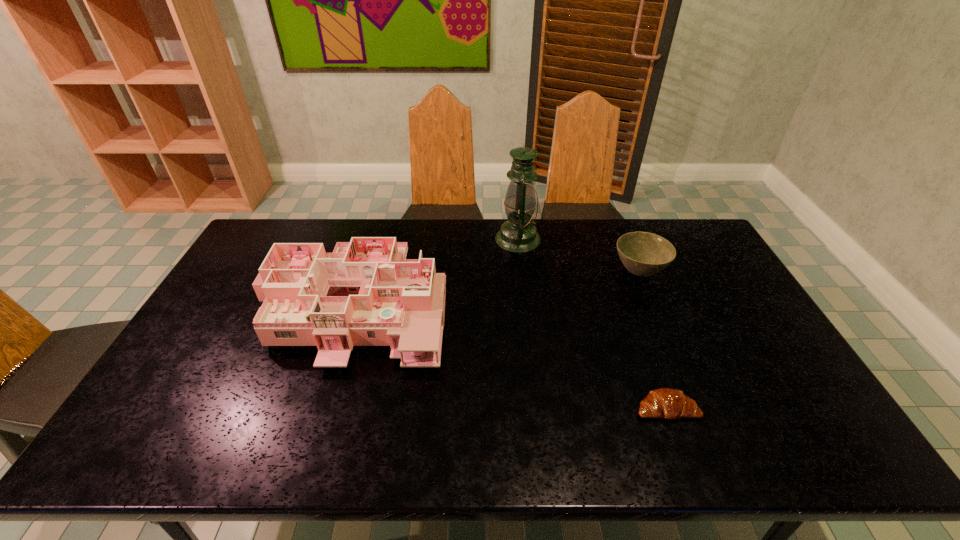
At what (x,y) coordinates should I click in order to perform the action: click on oil lamp. Please return your answer as a coordinate pair (x, y). The height and width of the screenshot is (540, 960). Looking at the image, I should click on (518, 235).

Find the location of a particular element. the tallest object is located at coordinates (518, 235).

I want to click on the second tallest object, so click(366, 293).

At what (x,y) coordinates should I click in order to perform the action: click on the leftmost object. Please return your answer as a coordinate pair (x, y). Looking at the image, I should click on (366, 293).

You are a GUI agent. You are given a task and a screenshot of the screen. Output one action in this format:
    pyautogui.click(x=<x>, y=<y>)
    Task: Click on the third tallest object
    
    Given the screenshot: What is the action you would take?
    pyautogui.click(x=643, y=254)

At what (x,y) coordinates should I click in order to perform the action: click on the shortest object. Please return your answer as a coordinate pair (x, y). Looking at the image, I should click on (667, 403).

Identify the location of crescent roll. (667, 403).

Identify the location of free region located 0.150m on the right of the second object from left to right. (581, 239).

Locate an element on the screen. The width and height of the screenshot is (960, 540). vacant region located at the front entrance of the third shortest object is located at coordinates (312, 449).

Locate an element on the screen. The height and width of the screenshot is (540, 960). vacant space situated 0.170m on the right of the third tallest object is located at coordinates (717, 273).